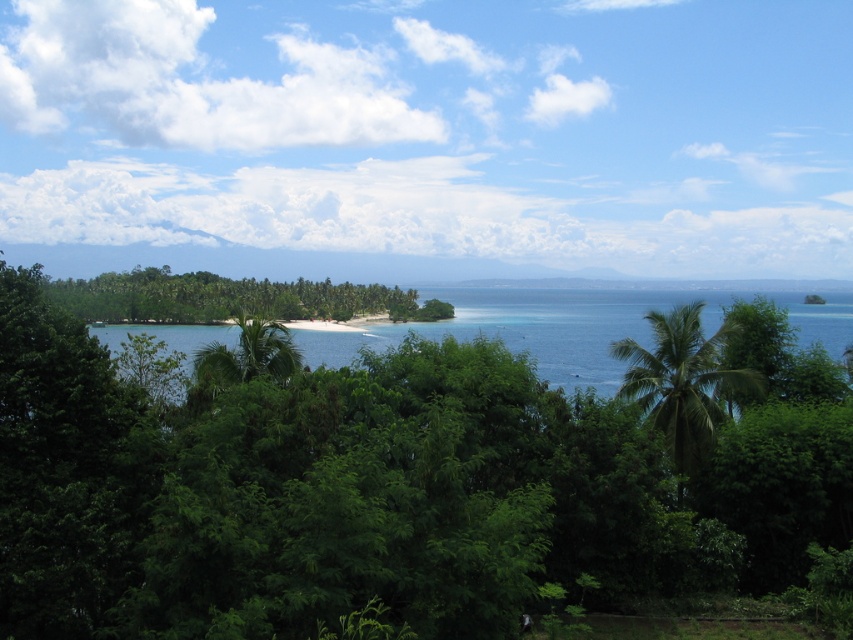
Based on the photo, you are a drone operator trying to locate the green leafy island at center in a tropical landscape. Based on the coordinates provided, where would you direct your drone to find it?

The green leafy island at center is located at point coordinates of (229, 298).